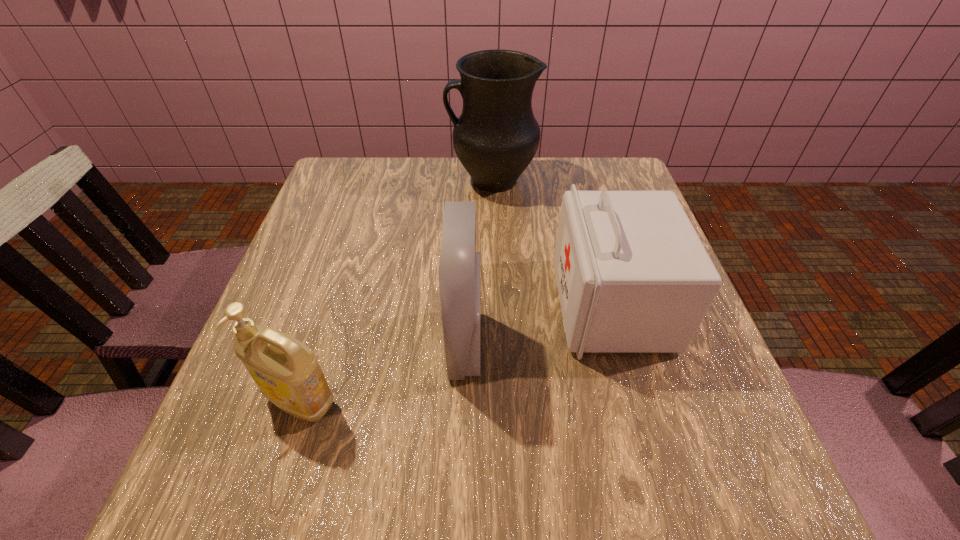
Find the location of a particular element. The width and height of the screenshot is (960, 540). blank space located 0.060m on the front-facing side of the rightmost object is located at coordinates (528, 306).

Where is `blank space located 0.110m on the right of the leftmost object`? Image resolution: width=960 pixels, height=540 pixels. blank space located 0.110m on the right of the leftmost object is located at coordinates (405, 402).

Identify the location of object that is positioned at the far edge. The image size is (960, 540). (496, 137).

This screenshot has height=540, width=960. I want to click on object that is positioned at the left edge, so click(287, 372).

Locate an element on the screen. Image resolution: width=960 pixels, height=540 pixels. object present at the right edge is located at coordinates (633, 276).

Find the location of `vacant position at the far edge of the desktop`. vacant position at the far edge of the desktop is located at coordinates (553, 158).

The height and width of the screenshot is (540, 960). In the image, there is a desktop. In order to click on blank space at the near edge in this screenshot , I will do `click(625, 482)`.

Where is `vacant space at the left edge`? The image size is (960, 540). vacant space at the left edge is located at coordinates (322, 238).

Where is `vacant space at the right edge of the desktop`? vacant space at the right edge of the desktop is located at coordinates (695, 396).

The width and height of the screenshot is (960, 540). In the image, there is a desktop. Identify the location of free space at the far left corner. (332, 204).